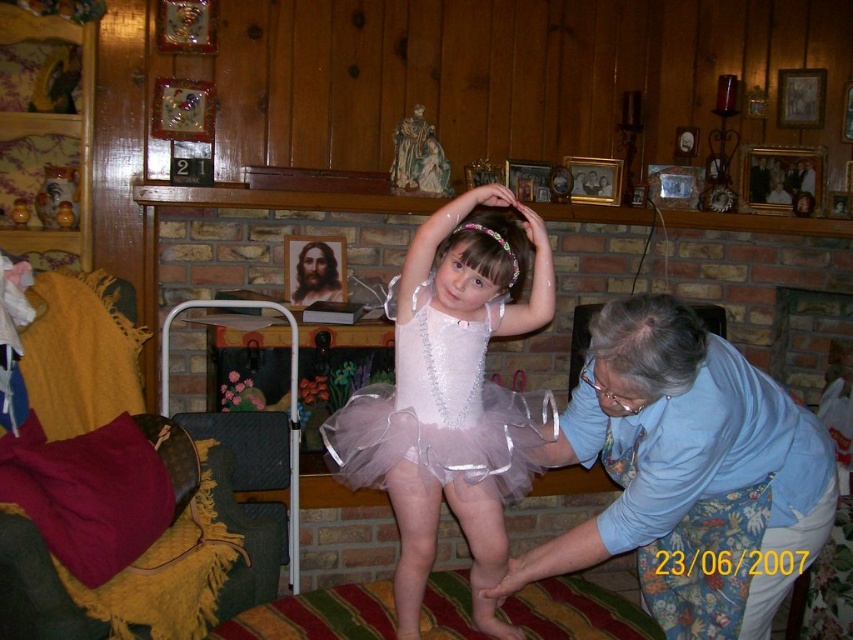
Does blue floral apron at lower right lie behind pale pink tulle tutu at center?

No.

Between point (583, 440) and point (496, 516), which one is positioned behind?

The point (496, 516) is behind.

The width and height of the screenshot is (853, 640). What are the coordinates of `blue floral apron at lower right` in the screenshot? It's located at (689, 474).